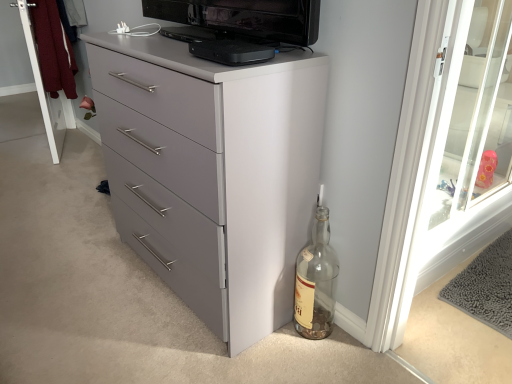
Locate an element on the screen. This screenshot has width=512, height=384. empty space that is to the right of white wood screen door at upper left, placed as the first screen door when sorted from left to right is located at coordinates (82, 149).